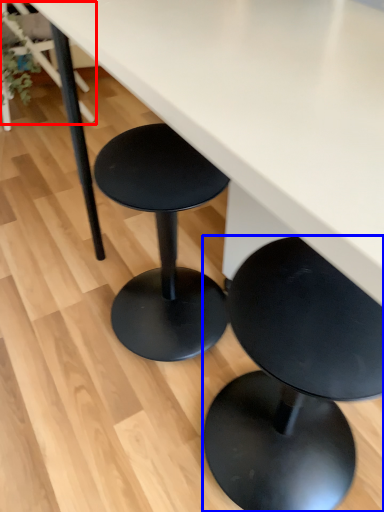
Question: Which point is closer to the camera, chair (highlighted by a red box) or stool (highlighted by a blue box)?

Choices:
 (A) chair
 (B) stool

Answer: (B)